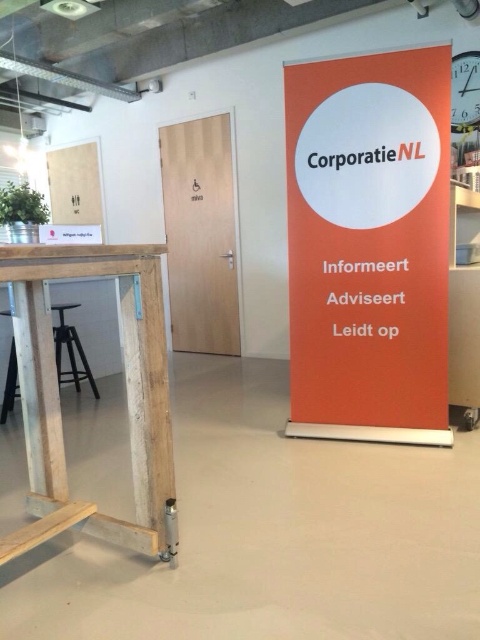
Question: Which object is farther from the camera taking this photo?

Choices:
 (A) wooden table at left
 (B) white matte paper at upper left
 (C) black leather stool at lower left
 (D) orange matte sign at right

Answer: (B)

Question: Is white matte paper at upper left wider than black leather stool at lower left?

Choices:
 (A) yes
 (B) no

Answer: (A)

Question: Is the position of wooden table at left less distant than that of black leather stool at lower left?

Choices:
 (A) no
 (B) yes

Answer: (B)

Question: Estimate the real-world distances between objects in this image. Which object is farther from the orange matte sign at right?

Choices:
 (A) black leather stool at lower left
 (B) white matte paper at upper left
 (C) wooden table at left

Answer: (B)

Question: Is wooden table at left wider than white matte paper at upper left?

Choices:
 (A) no
 (B) yes

Answer: (A)

Question: Which point is closer to the camera?

Choices:
 (A) orange matte sign at right
 (B) wooden table at left
 (C) white matte paper at upper left
 (D) black leather stool at lower left

Answer: (B)